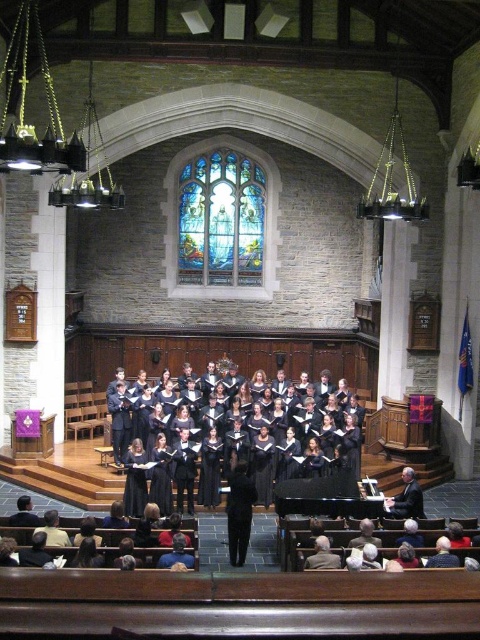
The width and height of the screenshot is (480, 640). Identify the location of black velvet choir at center. (242, 435).

Image resolution: width=480 pixels, height=640 pixels. What do you see at coordinates (242, 435) in the screenshot?
I see `black velvet choir at center` at bounding box center [242, 435].

Identify the location of black velvet choir at center. (242, 435).

Who is lower down, black velvet choir at center or black smooth conductor at center?

black smooth conductor at center is lower down.

Consider the image. Between black velvet choir at center and black smooth conductor at center, which one has less height?

With less height is black smooth conductor at center.

Which is in front, point (149, 422) or point (400, 497)?

Point (400, 497) is in front.

Locate an element on the screen. This screenshot has height=640, width=480. black velvet choir at center is located at coordinates (242, 435).

Who is lower down, stained glass window at center or black smooth conductor at center?

black smooth conductor at center is lower down.

This screenshot has height=640, width=480. In order to click on stained glass window at center in this screenshot , I will do `click(220, 220)`.

Find the location of `stained glass window at center`. stained glass window at center is located at coordinates (220, 220).